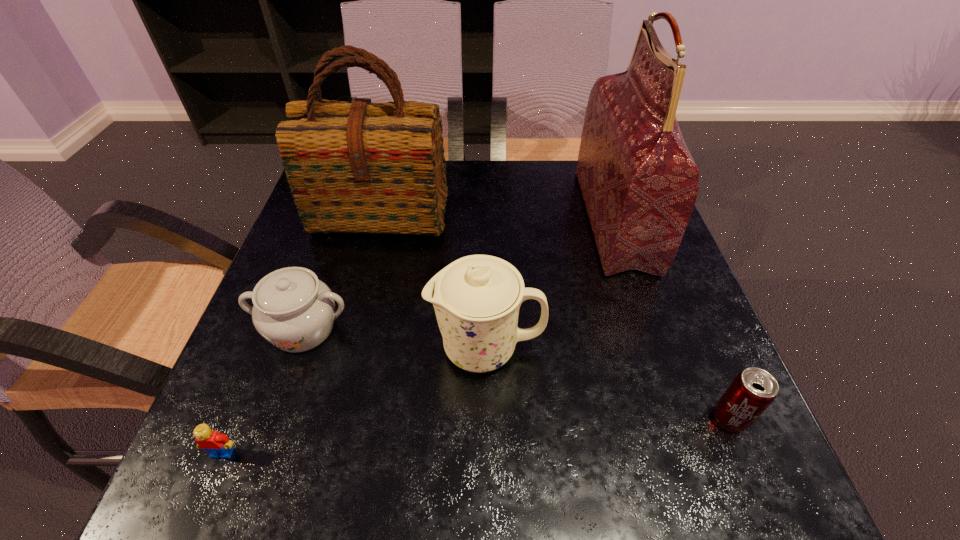
You are a GUI agent. You are given a task and a screenshot of the screen. Output one action in this format:
    pyautogui.click(x=<x>, y=<y>)
    Task: Click on the handbag
    
    Given the screenshot: What is the action you would take?
    pyautogui.click(x=639, y=182)

Identify the location of the second tallest object. This screenshot has height=540, width=960. (353, 167).

Find the location of `the taller chinaware`. the taller chinaware is located at coordinates (477, 298).

This screenshot has width=960, height=540. What are the coordinates of `the third tallest object` in the screenshot? It's located at (477, 298).

The image size is (960, 540). I want to click on the third shortest object, so click(x=292, y=309).

Locate an element on the screen. the left chinaware is located at coordinates (292, 309).

Identify the location of the second nearest object. (752, 391).

Image resolution: width=960 pixels, height=540 pixels. I want to click on beer can, so click(x=752, y=391).

Locate an element on the screen. This screenshot has height=540, width=960. the nearest object is located at coordinates (217, 444).

I want to click on the shortest object, so click(217, 444).